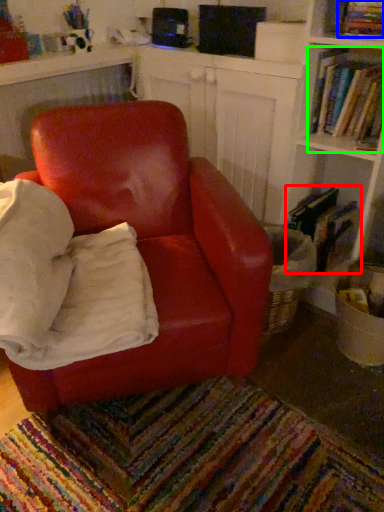
Question: Considering the real-world distances, which object is closest to book (highlighted by a red box)? book (highlighted by a blue box) or book (highlighted by a green box).

Choices:
 (A) book
 (B) book

Answer: (B)